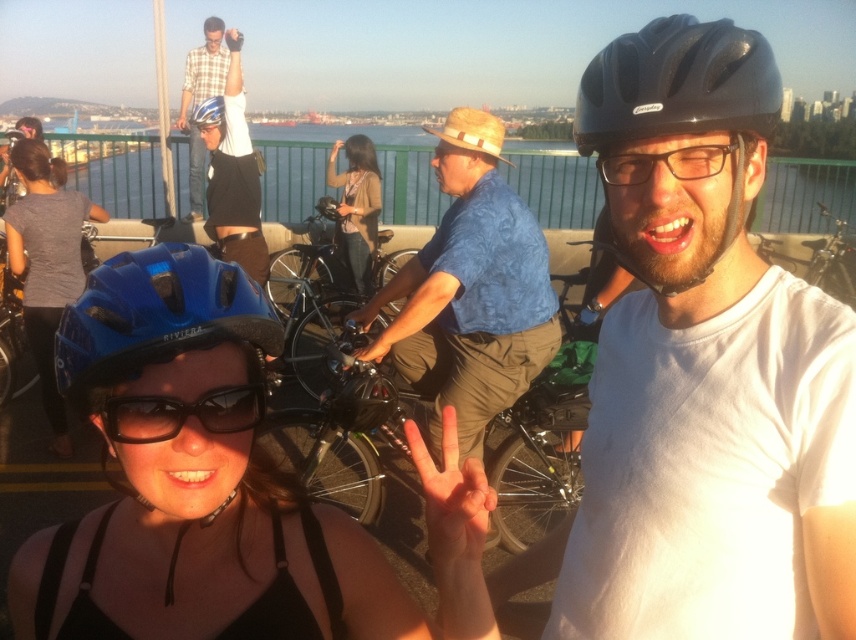
Question: Is black reflective sunglasses at lower left further to the viewer compared to plaid shirt at upper center?

Choices:
 (A) yes
 (B) no

Answer: (B)

Question: Which of the following is the closest to the observer?

Choices:
 (A) blue matte helmet at center
 (B) matte blue helmet at upper center
 (C) black reflective sunglasses at lower left
 (D) gray matte shirt at lower left

Answer: (A)

Question: Which point appears farthest from the camera in this image?

Choices:
 (A) (162, 294)
 (B) (366, 204)
 (C) (621, 161)
 (D) (36, 340)

Answer: (B)

Question: Can you confirm if black matte helmet at center is smaller than brown textured sweater at center?

Choices:
 (A) no
 (B) yes

Answer: (B)

Question: Among these points, which one is farthest from the camera?

Choices:
 (A) (361, 147)
 (B) (510, 317)
 (C) (201, 145)

Answer: (C)

Question: In this image, where is black matte helmet at center located relative to clear plastic glasses at center?

Choices:
 (A) above
 (B) below

Answer: (B)